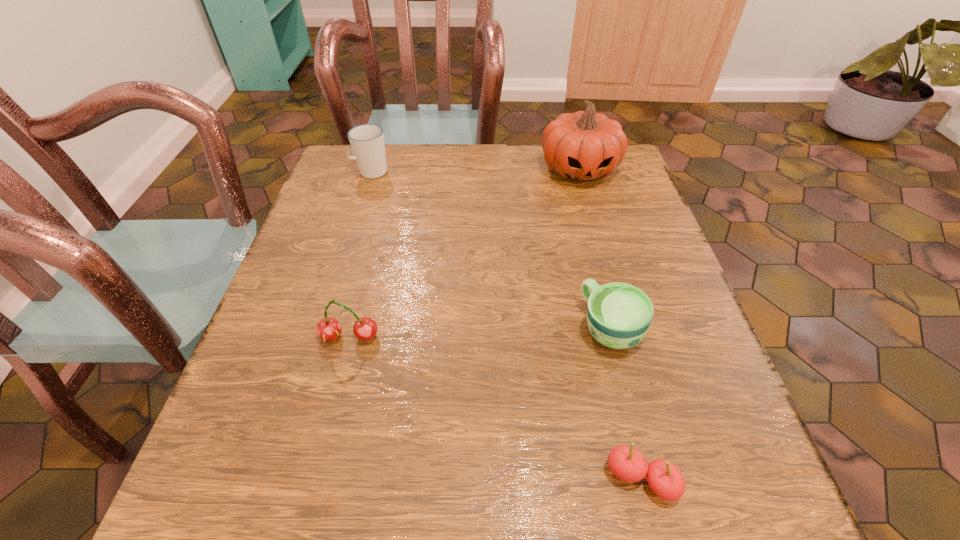
Where is `vacant space at the far right corner`? vacant space at the far right corner is located at coordinates (587, 182).

You are a GUI agent. You are given a task and a screenshot of the screen. Output one action in this format:
    pyautogui.click(x=<x>, y=<y>)
    Task: Click on the blank space at the near right corner of the desktop
    
    Given the screenshot: What is the action you would take?
    pyautogui.click(x=718, y=479)

This screenshot has width=960, height=540. What are the coordinates of `free area in between the taller cherry and the tallest object` in the screenshot? It's located at (465, 253).

Where is `free space between the left cherry and the right cup`? Image resolution: width=960 pixels, height=540 pixels. free space between the left cherry and the right cup is located at coordinates (480, 333).

Find the location of a particular element. free space between the taller cup and the pumpkin is located at coordinates (475, 171).

The image size is (960, 540). Find the location of `free area in between the farther cup and the pumpkin`. free area in between the farther cup and the pumpkin is located at coordinates (475, 171).

What are the coordinates of `unoccupied area between the left cup and the pumpkin` in the screenshot? It's located at (475, 171).

In order to click on free space between the taller cup and the shorter cup in this screenshot , I will do `click(491, 250)`.

Find the location of `vacant space that's between the right cherry and the taller cup`. vacant space that's between the right cherry and the taller cup is located at coordinates (506, 326).

Where is `free space between the nearer cup and the right cherry`? The width and height of the screenshot is (960, 540). free space between the nearer cup and the right cherry is located at coordinates (626, 404).